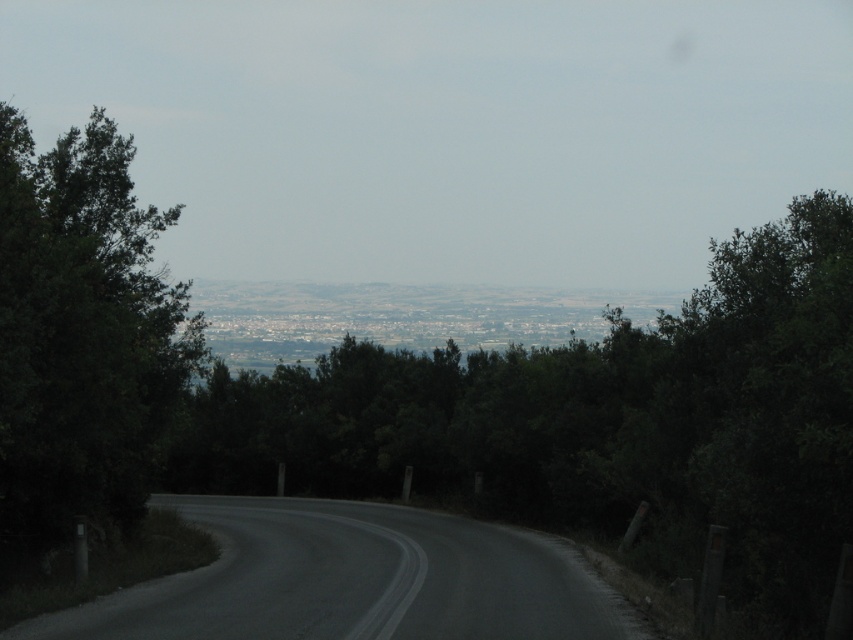
You are driving a car and see two points on the road ahead. The first is at point (827, 369) and the second is at point (65, 632). Which point is closer to your current position?

Point (827, 369) is in front of point (65, 632), so the first point is closer to your current position.

You are a drone operator flying a drone that has a maximum flight distance of 10 meters. You are positioned at the camera location and want to capture a close shot of the green leafy tree at center. Can your drone reach the tree?

The green leafy tree at center is 8.49 meters from camera, so yes, the drone can reach the tree since it is within the maximum flight distance of 10 meters.

You are a hiker standing on the winding road and want to know which tree is wider between the green leafy tree at center and the green leafy tree at left. Which one should you point to?

The green leafy tree at center is wider than the green leafy tree at left.